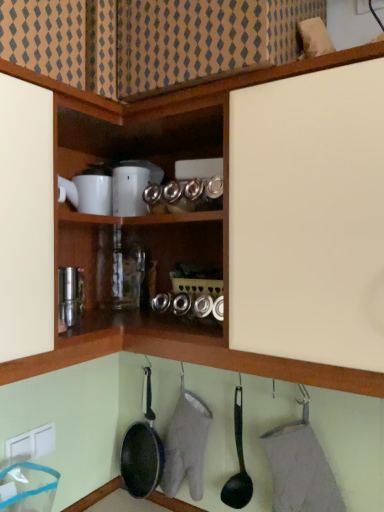
Question: Is black non-stick frying pan at lower center, arranged as the 2th frying pan when viewed from the right, facing away from black plastic frying pan at lower center, the second frying pan positioned from the left?

Choices:
 (A) no
 (B) yes

Answer: (A)

Question: Is black non-stick frying pan at lower center, which ranks as the 1th frying pan in left-to-right order, aimed at black plastic frying pan at lower center, which appears as the 2th frying pan when viewed from the back?

Choices:
 (A) yes
 (B) no

Answer: (B)

Question: Does black non-stick frying pan at lower center, the 2th frying pan viewed from the front, have a larger size compared to black plastic frying pan at lower center, the second frying pan positioned from the left?

Choices:
 (A) no
 (B) yes

Answer: (B)

Question: Is black non-stick frying pan at lower center, arranged as the 2th frying pan when viewed from the right, behind black plastic frying pan at lower center, placed as the first frying pan when sorted from right to left?

Choices:
 (A) no
 (B) yes

Answer: (B)

Question: Can you confirm if black non-stick frying pan at lower center, which is counted as the first frying pan, starting from the back, is positioned to the right of black plastic frying pan at lower center, which appears as the 2th frying pan when viewed from the back?

Choices:
 (A) no
 (B) yes

Answer: (A)

Question: Does black non-stick frying pan at lower center, arranged as the 2th frying pan when viewed from the right, have a smaller size compared to black plastic frying pan at lower center, the second frying pan positioned from the left?

Choices:
 (A) yes
 (B) no

Answer: (B)

Question: Can you see black plastic frying pan at lower center, placed as the 1th frying pan when sorted from front to back, touching white plastic electric outlet at lower left?

Choices:
 (A) no
 (B) yes

Answer: (A)

Question: From the image's perspective, is black plastic frying pan at lower center, placed as the 1th frying pan when sorted from front to back, above white plastic electric outlet at lower left?

Choices:
 (A) yes
 (B) no

Answer: (A)

Question: Considering the relative positions of black plastic frying pan at lower center, placed as the 1th frying pan when sorted from front to back, and white plastic electric outlet at lower left in the image provided, is black plastic frying pan at lower center, placed as the 1th frying pan when sorted from front to back, to the left of white plastic electric outlet at lower left from the viewer's perspective?

Choices:
 (A) yes
 (B) no

Answer: (B)

Question: Does black plastic frying pan at lower center, placed as the 1th frying pan when sorted from front to back, have a greater width compared to white plastic electric outlet at lower left?

Choices:
 (A) no
 (B) yes

Answer: (B)

Question: Is black plastic frying pan at lower center, the second frying pan positioned from the left, at the right side of white plastic electric outlet at lower left?

Choices:
 (A) yes
 (B) no

Answer: (A)

Question: From the image's perspective, is black plastic frying pan at lower center, placed as the 1th frying pan when sorted from front to back, beneath white plastic electric outlet at lower left?

Choices:
 (A) yes
 (B) no

Answer: (B)

Question: Is white glossy coffee maker at upper center not close to black plastic frying pan at lower center, the second frying pan positioned from the left?

Choices:
 (A) no
 (B) yes

Answer: (A)